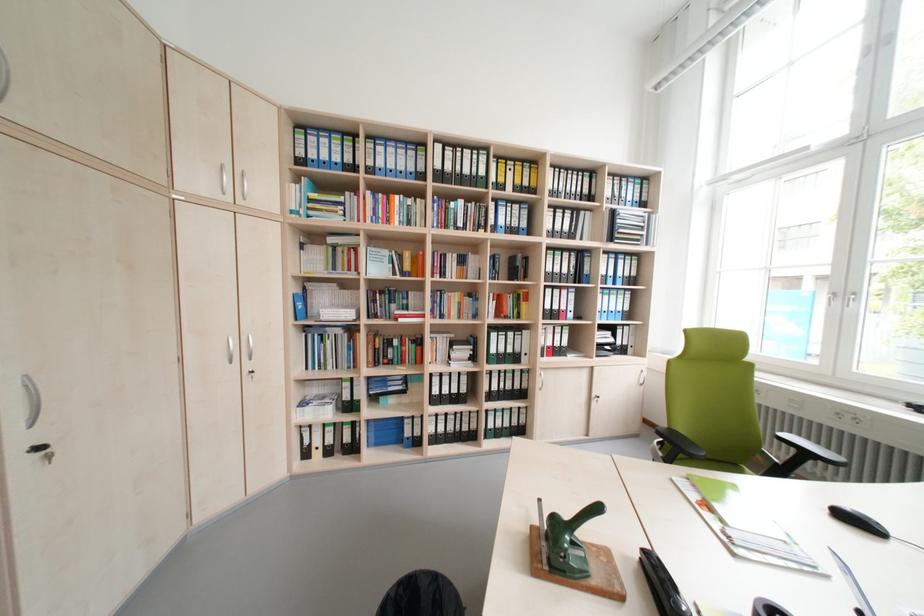
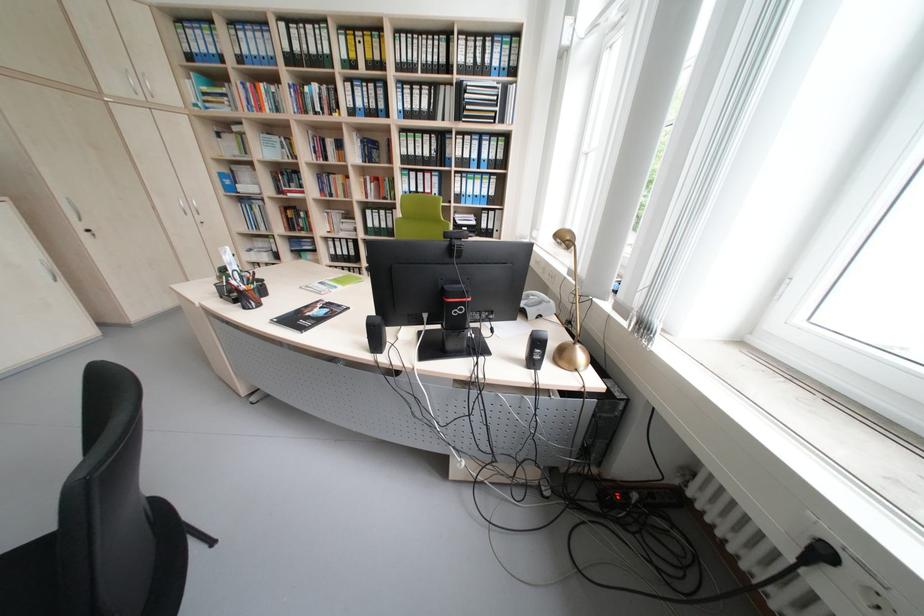
Find the pixel in the second image that matches (x=382, y=302) in the first image.

(286, 182)